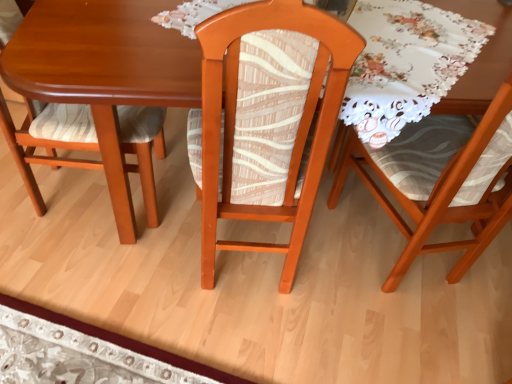
This screenshot has width=512, height=384. Find the location of `unoccupied area in front of wooden chair at right, positioned as the 1th chair in right-to-left order`. unoccupied area in front of wooden chair at right, positioned as the 1th chair in right-to-left order is located at coordinates (404, 333).